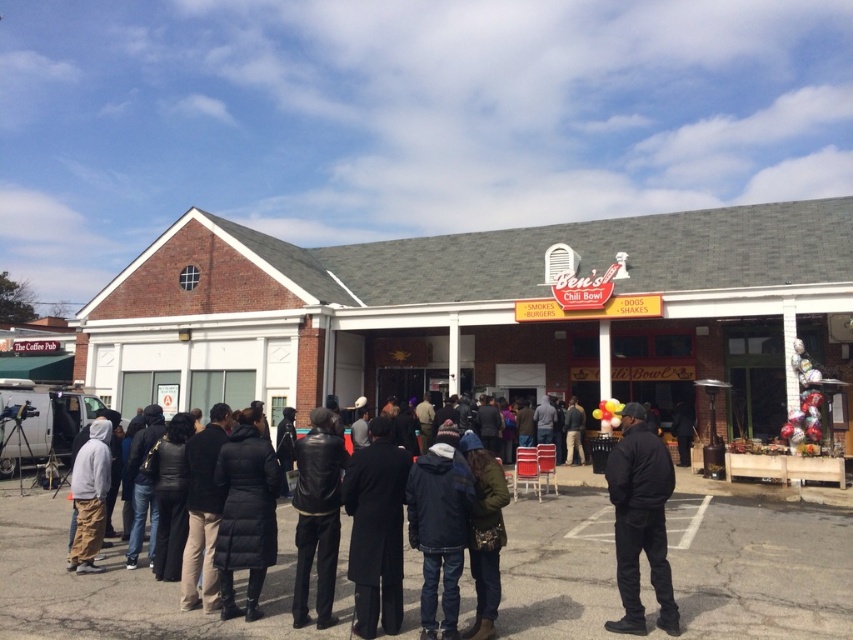
Who is more forward, [155,304] or [460,476]?

Positioned in front is point [460,476].

The width and height of the screenshot is (853, 640). What do you see at coordinates (485, 314) in the screenshot?
I see `white brick building at center` at bounding box center [485, 314].

Is point (502, 243) closer to viewer compared to point (434, 627)?

No, it is not.

This screenshot has width=853, height=640. In order to click on white brick building at center in this screenshot , I will do `click(485, 314)`.

Is white brick building at center wider than dark gray jacket at center?

Yes, white brick building at center is wider than dark gray jacket at center.

In the scene shown: Who is more distant from viewer, (x=577, y=385) or (x=582, y=428)?

Point (x=577, y=385)

Does point (838, 234) come behind point (567, 458)?

That is True.

Find the location of a particular element. white brick building at center is located at coordinates (485, 314).

Find the location of a particular element. The width and height of the screenshot is (853, 640). green fabric jacket at center is located at coordinates (485, 532).

Can you confirm if green fabric jacket at center is positioned below gray hoodie at left?

No.

I want to click on green fabric jacket at center, so click(485, 532).